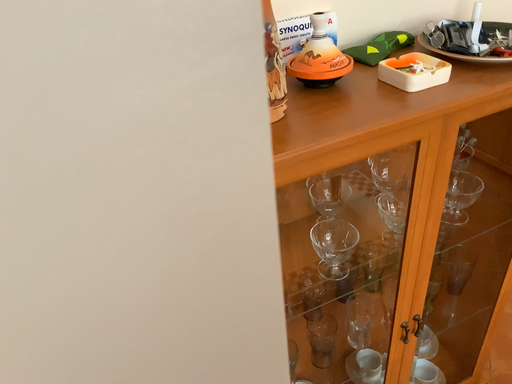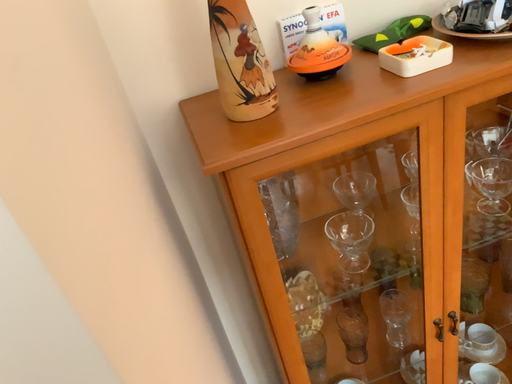
Question: Which way did the camera rotate in the video?

Choices:
 (A) rotated left
 (B) rotated right

Answer: (A)